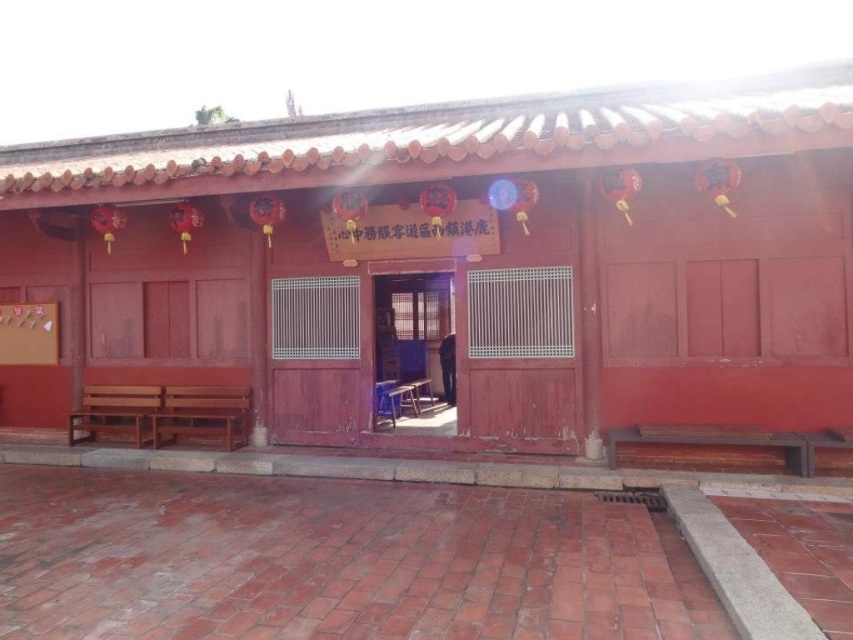
Question: Does matte wood hut at center appear on the left side of wooden door at center?

Choices:
 (A) no
 (B) yes

Answer: (A)

Question: Is matte wood hut at center in front of wooden door at center?

Choices:
 (A) no
 (B) yes

Answer: (B)

Question: Which object appears farthest from the camera in this image?

Choices:
 (A) matte wood hut at center
 (B) wooden door at center

Answer: (B)

Question: In this image, where is matte wood hut at center located relative to wooden door at center?

Choices:
 (A) left
 (B) right

Answer: (B)

Question: Which point is farther to the camera?

Choices:
 (A) (407, 317)
 (B) (106, 372)

Answer: (A)